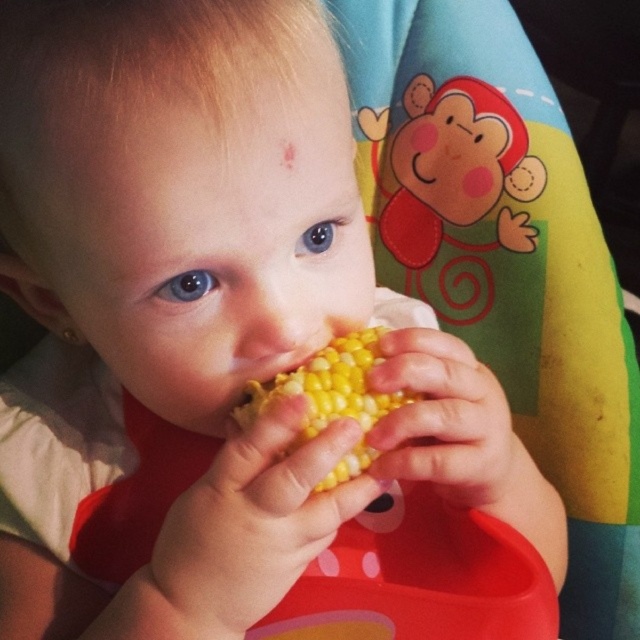
The image shows a child eating corn on the cob. There is a point marked at coordinates (328,387). What object is located at this point?

The point at coordinates (328,387) marks the yellow matte corn at center.